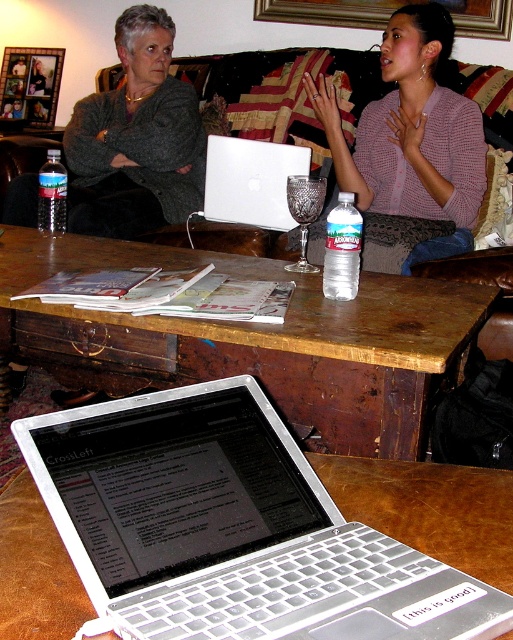
You are planning to place a new book that is 12 inches wide on the brown wooden table at center. The white glossy laptop at center is currently occupying some space. Can the book fit on the table without moving the laptop?

The brown wooden table at center is larger in size than the white glossy laptop at center, so there should be enough space to place the 12 inch wide book next to the laptop without moving it.

What are the coordinates of the brown wooden table at center?

The brown wooden table at center is located at coordinates point (251, 339).

You are a person who is 5 feet tall. You want to pick up the glass of water from the brown wooden table at center. Can you comfortably reach it without moving your feet?

The brown wooden table at center is 3.63 feet away from the viewer. Since the average arm length for a 5 feet tall person is about 2.5 feet, the distance is beyond their reach. Therefore, you cannot comfortably pick up the glass of water without moving your feet.